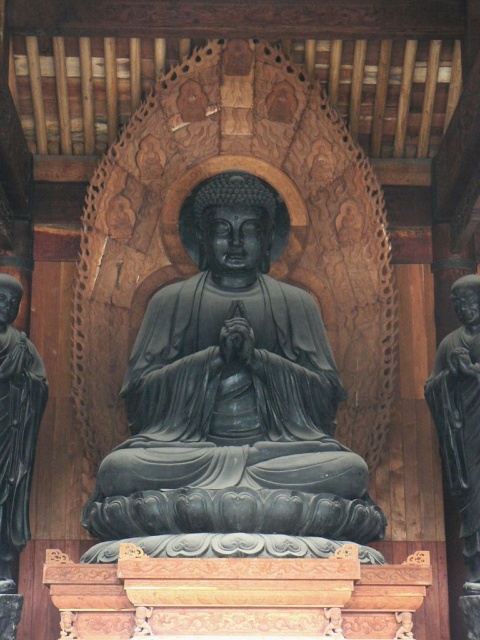
You are an art conservator examining the statue arrangement in the temple. You need to determine the spatial relationship between the black stone statue at right and the matte black statue at left. Which statue is positioned lower in the scene?

The black stone statue at right is located below matte black statue at left, so it is positioned lower in the scene.

You are standing in front of the statue of Buddha. There are two black stone statues here. One is the black polished stone buddha at center and the other is the black stone statue at right. Which one is closer to you?

The black polished stone buddha at center is closer to you than the black stone statue at right.